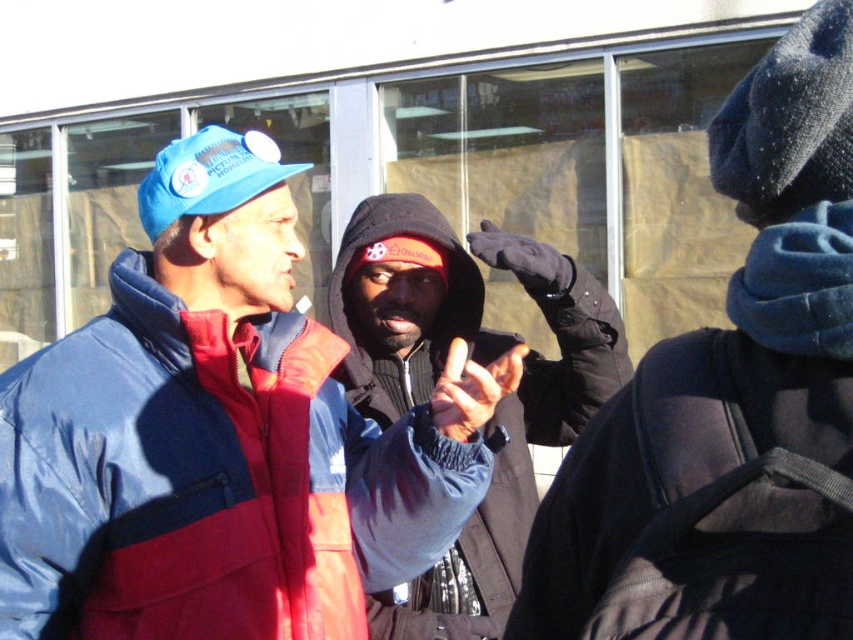
Based on the coordinates provided, which object in the scene is located at point (730,404)?

The dark blue jacket at center is located at point (730,404).

You are trying to determine if a dark blue fleece jacket at center can fit into a storage box that is the same width as matte blue cap at upper left. Can it fit?

The dark blue fleece jacket at center might be wider than matte blue cap at upper left, so it may not fit into the storage box designed for the cap.

You are looking at the image of two men talking outside. The dark blue jacket at center and the black synthetic jacket at lower right are part of their outfits. Which jacket is positioned higher in the image?

The dark blue jacket at center is positioned higher than the black synthetic jacket at lower right.